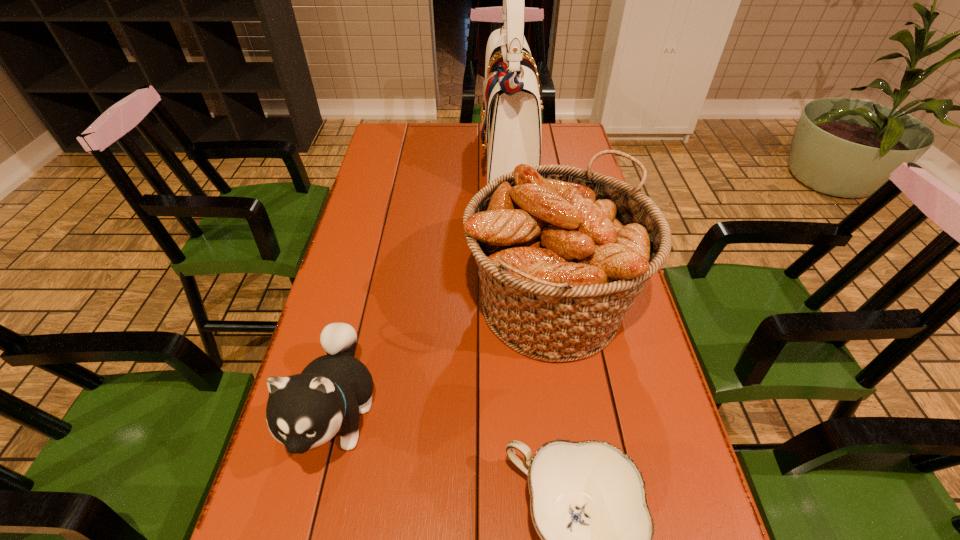
Find the location of a particular element. Image resolution: width=960 pixels, height=540 pixels. the tallest object is located at coordinates (511, 113).

This screenshot has height=540, width=960. In order to click on the farthest object in this screenshot , I will do `click(511, 113)`.

At what (x,y) coordinates should I click in order to perform the action: click on the third shortest object. Please return your answer as a coordinate pair (x, y). Looking at the image, I should click on (562, 252).

Where is `the third tallest object`? the third tallest object is located at coordinates (304, 411).

Identify the location of puppy. (304, 411).

This screenshot has width=960, height=540. I want to click on vacant position located 0.340m on the front-facing side of the tallest object, so click(x=389, y=160).

Identify the location of vacant position located on the front-facing side of the tallest object. The height and width of the screenshot is (540, 960). (456, 160).

The image size is (960, 540). Identify the location of free spot located on the front-facing side of the tallest object. (462, 160).

Locate an element on the screen. This screenshot has width=960, height=540. vacant area situated on the left of the basket is located at coordinates (393, 306).

Locate an element on the screen. This screenshot has height=540, width=960. free spot located 0.070m at the face of the third tallest object is located at coordinates (308, 531).